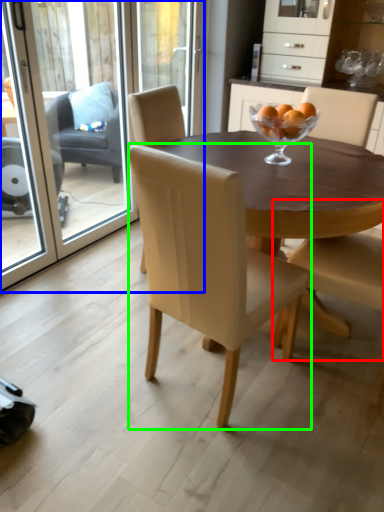
Question: Which object is positioned closest to chair (highlighted by a red box)? Select from screen door (highlighted by a blue box) and chair (highlighted by a green box).

Choices:
 (A) screen door
 (B) chair

Answer: (B)